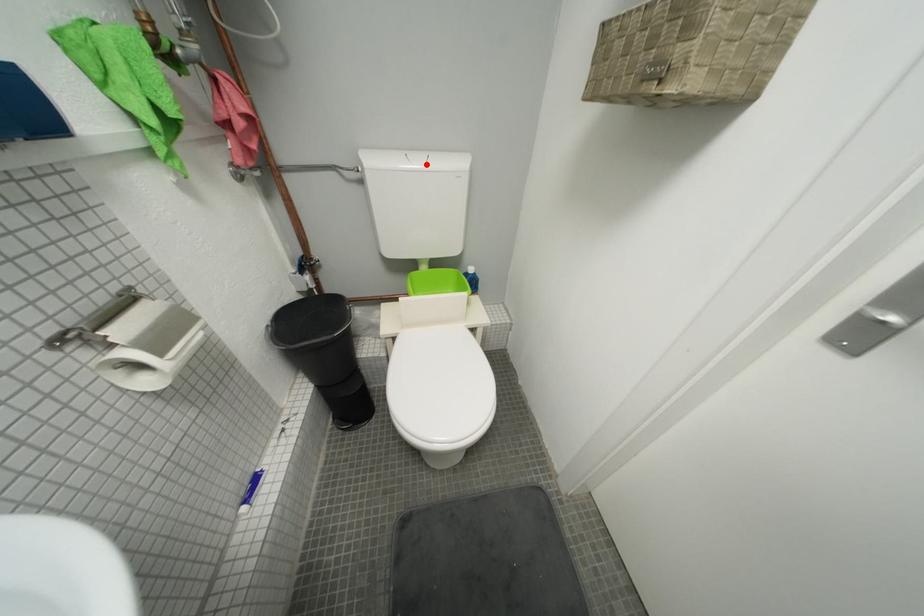
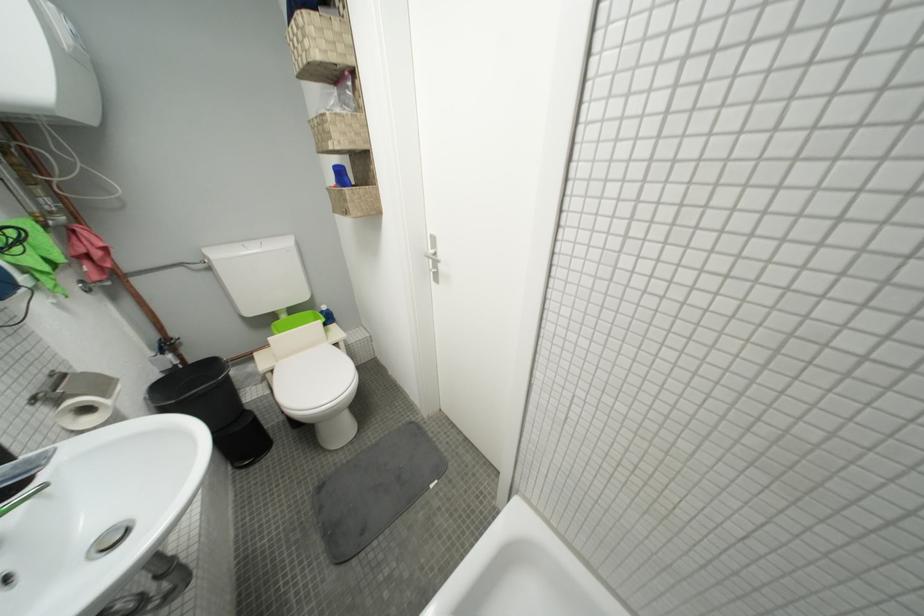
The point at the highlighted location is marked in the first image. Where is the corresponding point in the second image?

(262, 252)